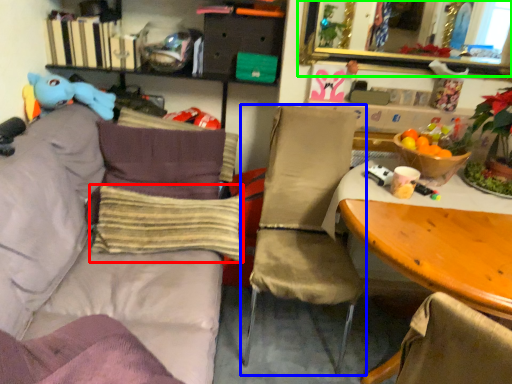
Question: Which is farther away from pillow (highlighted by a red box)? chair (highlighted by a blue box) or mirror (highlighted by a green box)?

Choices:
 (A) chair
 (B) mirror

Answer: (B)